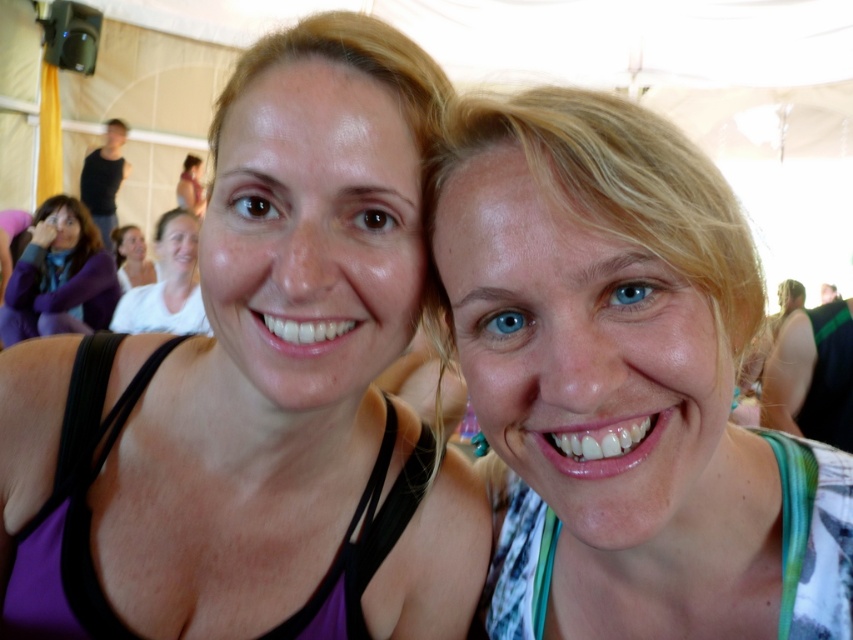
You are at a social event and want to take a photo of the purple fleece jacket at left and the matte white tank top at upper left. Which one is blocking the view of the other?

The purple fleece jacket at left is in front of the matte white tank top at upper left, so it is blocking the view of the matte white tank top at upper left.